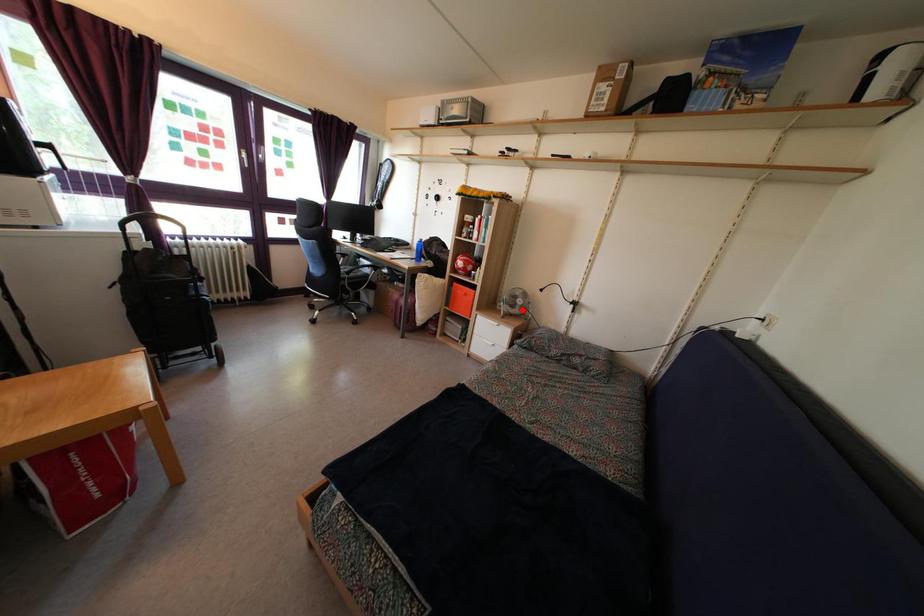
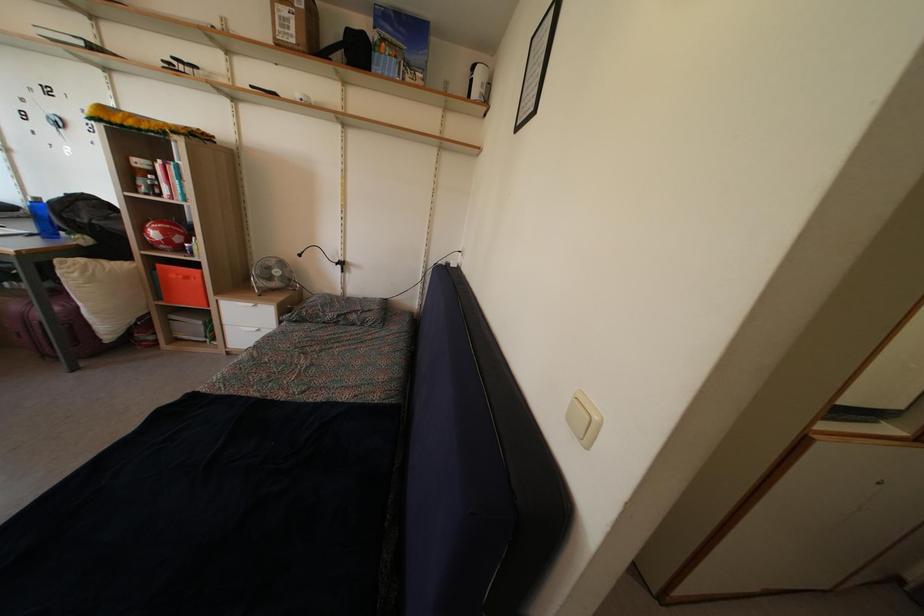
Question: I am providing you with two images of the same scene from different viewpoints. Image1 has a red point marked. In image2, the corresponding 3D location appears at what relative position? Reply with the corresponding letter.

Choices:
 (A) Closer
 (B) Farther

Answer: (A)